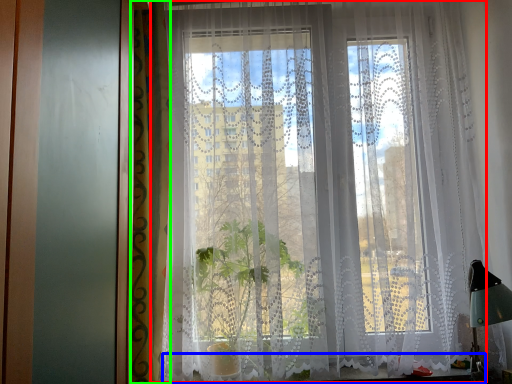
Question: Considering the real-world distances, which object is closest to curtain (highlighted by a red box)? window sill (highlighted by a blue box) or curtain (highlighted by a green box).

Choices:
 (A) window sill
 (B) curtain

Answer: (B)